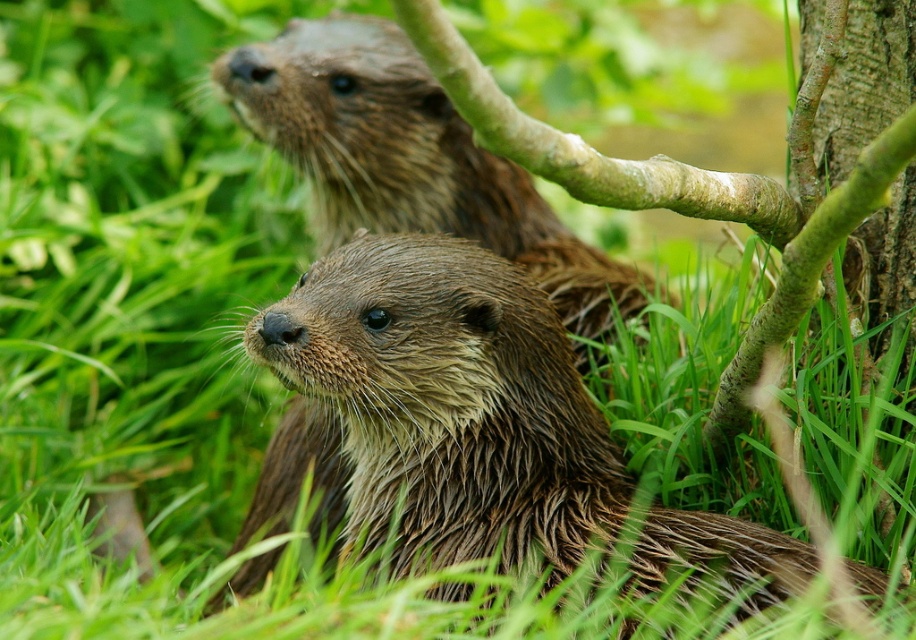
Is wet fur otter at center to the left of brown wet fur otter at upper center from the viewer's perspective?

No, wet fur otter at center is not to the left of brown wet fur otter at upper center.

Is point (440, 561) farther from viewer compared to point (399, 116)?

No, it is not.

The height and width of the screenshot is (640, 916). Identify the location of wet fur otter at center. (449, 403).